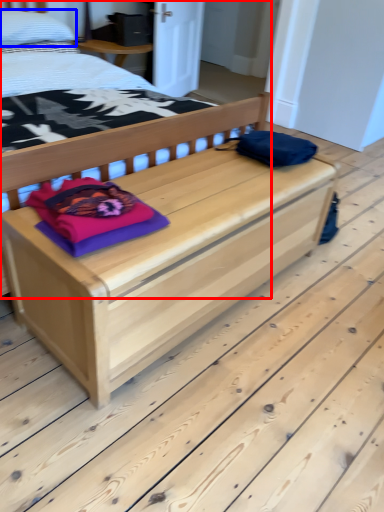
Question: Which object is closer to the camera taking this photo, bed (highlighted by a red box) or pillow (highlighted by a blue box)?

Choices:
 (A) bed
 (B) pillow

Answer: (A)